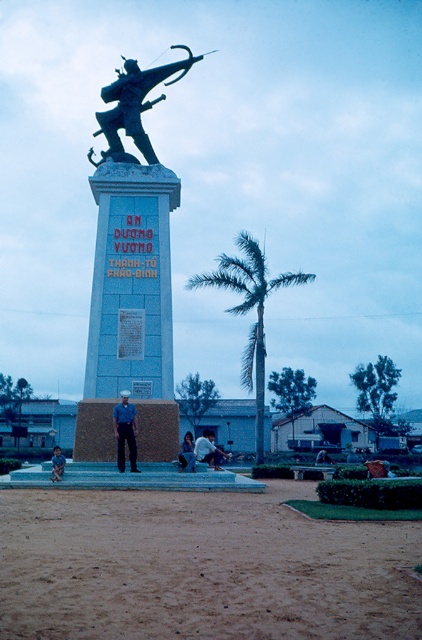
Question: Estimate the real-world distances between objects in this image. Which object is farther from the dark blue jeans at lower center?

Choices:
 (A) blue uniform at center
 (B) green leafy palm tree at center
 (C) blue stone statue at center

Answer: (B)

Question: Does green leafy palm tree at center appear over blue uniform at center?

Choices:
 (A) no
 (B) yes

Answer: (B)

Question: Is polished bronze statue at center above white fabric shirt at lower center?

Choices:
 (A) yes
 (B) no

Answer: (A)

Question: Does dark blue jeans at lower center have a smaller size compared to dark blue uniform at center?

Choices:
 (A) no
 (B) yes

Answer: (B)

Question: Among these objects, which one is farthest from the camera?

Choices:
 (A) polished bronze statue at center
 (B) dark blue uniform at center

Answer: (A)

Question: Which object is farther from the camera taking this photo?

Choices:
 (A) dark blue jeans at lower center
 (B) white fabric shirt at lower center
 (C) dark blue uniform at center
 (D) polished bronze statue at center

Answer: (D)